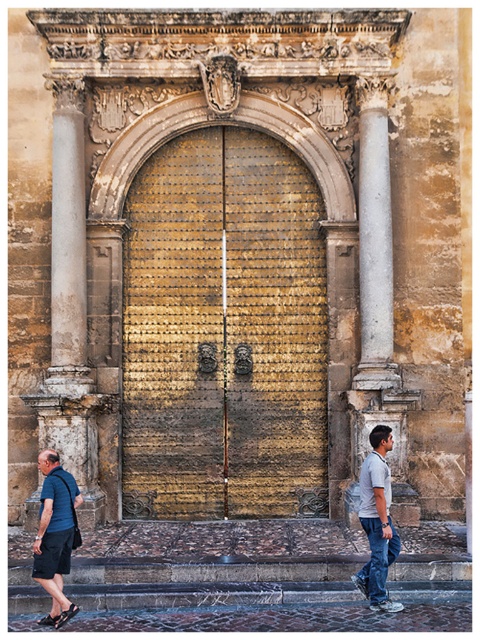
Question: Considering the relative positions of stone steps at lower center and denim jeans at lower right in the image provided, where is stone steps at lower center located with respect to denim jeans at lower right?

Choices:
 (A) above
 (B) below

Answer: (B)

Question: Which point is closer to the camera?

Choices:
 (A) white marble column at right
 (B) denim jeans at lower right
 (C) matte blue shirt at lower left

Answer: (C)

Question: Is white marble column at right positioned before denim jeans at lower right?

Choices:
 (A) yes
 (B) no

Answer: (B)

Question: Does stone column at left have a lesser width compared to matte blue shirt at lower left?

Choices:
 (A) yes
 (B) no

Answer: (A)

Question: Which point is farther from the camera taking this photo?

Choices:
 (A) (372, 321)
 (B) (212, 344)

Answer: (B)

Question: Which point is farther to the camera?

Choices:
 (A) stone column at left
 (B) gray cotton shirt at lower right

Answer: (A)